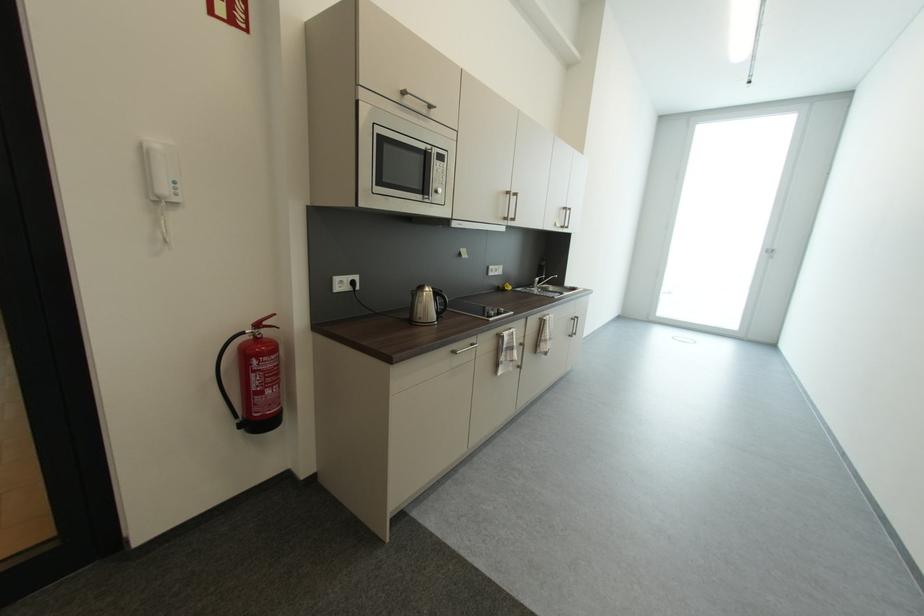
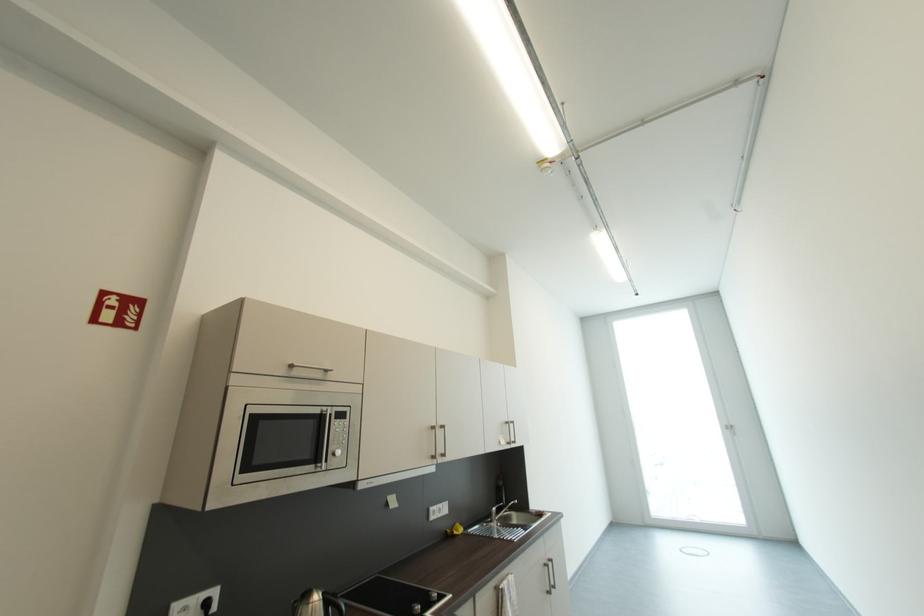
Locate, in the second image, the point that corresponds to point (505, 288) in the first image.

(454, 533)